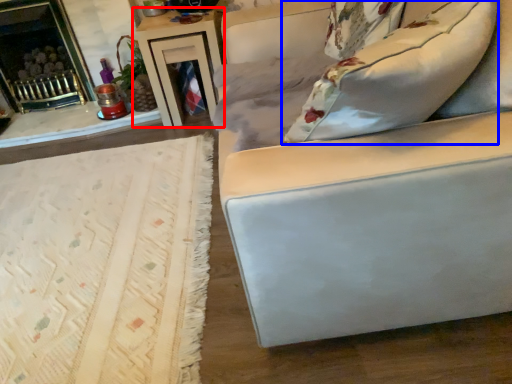
Question: Which point is further to the camera, table (highlighted by a red box) or pillow (highlighted by a blue box)?

Choices:
 (A) table
 (B) pillow

Answer: (A)